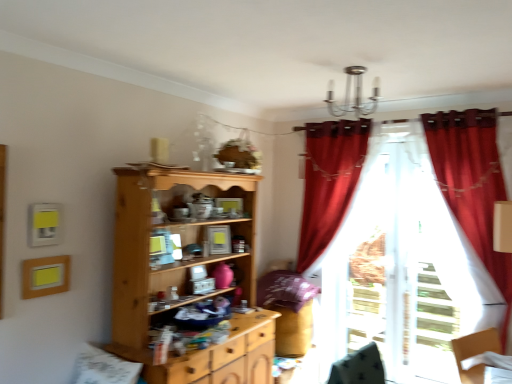
Question: From the image's perspective, is velvet red curtain at right, the second curtain when ordered from back to front, on top of translucent white curtain at right, which appears as the first curtain when viewed from the back?

Choices:
 (A) no
 (B) yes

Answer: (B)

Question: From a real-world perspective, is velvet red curtain at right, the second curtain when ordered from back to front, physically below translucent white curtain at right, which appears as the first curtain when viewed from the back?

Choices:
 (A) no
 (B) yes

Answer: (A)

Question: Considering the relative sizes of velvet red curtain at right, the second curtain when ordered from back to front, and translucent white curtain at right, the 2th curtain positioned from the front, in the image provided, is velvet red curtain at right, the second curtain when ordered from back to front, bigger than translucent white curtain at right, the 2th curtain positioned from the front,?

Choices:
 (A) yes
 (B) no

Answer: (A)

Question: Could you tell me if velvet red curtain at right, the second curtain when ordered from back to front, is turned towards translucent white curtain at right, which appears as the first curtain when viewed from the back?

Choices:
 (A) no
 (B) yes

Answer: (A)

Question: Can you confirm if velvet red curtain at right, the second curtain when ordered from back to front, is smaller than translucent white curtain at right, the 2th curtain positioned from the front?

Choices:
 (A) yes
 (B) no

Answer: (B)

Question: Is velvet red curtain at right, the second curtain when ordered from back to front, in contact with translucent white curtain at right, the 2th curtain positioned from the front?

Choices:
 (A) no
 (B) yes

Answer: (A)

Question: Is translucent white curtain at right, which appears as the first curtain when viewed from the back, not inside velvet red curtain at right, the second curtain when ordered from back to front?

Choices:
 (A) yes
 (B) no

Answer: (A)

Question: Is translucent white curtain at right, which appears as the first curtain when viewed from the back, wider than velvet red curtain at right, the second curtain when ordered from back to front?

Choices:
 (A) yes
 (B) no

Answer: (B)

Question: Is translucent white curtain at right, which appears as the first curtain when viewed from the back, to the left of velvet red curtain at right, which ranks as the first curtain in front-to-back order, from the viewer's perspective?

Choices:
 (A) yes
 (B) no

Answer: (A)

Question: Is translucent white curtain at right, which appears as the first curtain when viewed from the back, with velvet red curtain at right, which ranks as the first curtain in front-to-back order?

Choices:
 (A) no
 (B) yes

Answer: (A)

Question: Is translucent white curtain at right, which appears as the first curtain when viewed from the back, positioned before velvet red curtain at right, the second curtain when ordered from back to front?

Choices:
 (A) yes
 (B) no

Answer: (B)

Question: Considering the relative positions of translucent white curtain at right, which appears as the first curtain when viewed from the back, and velvet red curtain at right, which ranks as the first curtain in front-to-back order, in the image provided, is translucent white curtain at right, which appears as the first curtain when viewed from the back, to the right of velvet red curtain at right, which ranks as the first curtain in front-to-back order, from the viewer's perspective?

Choices:
 (A) no
 (B) yes

Answer: (A)

Question: Can you confirm if velvet red curtain at right, the second curtain when ordered from back to front, is thinner than light wood cupboard at center?

Choices:
 (A) yes
 (B) no

Answer: (A)